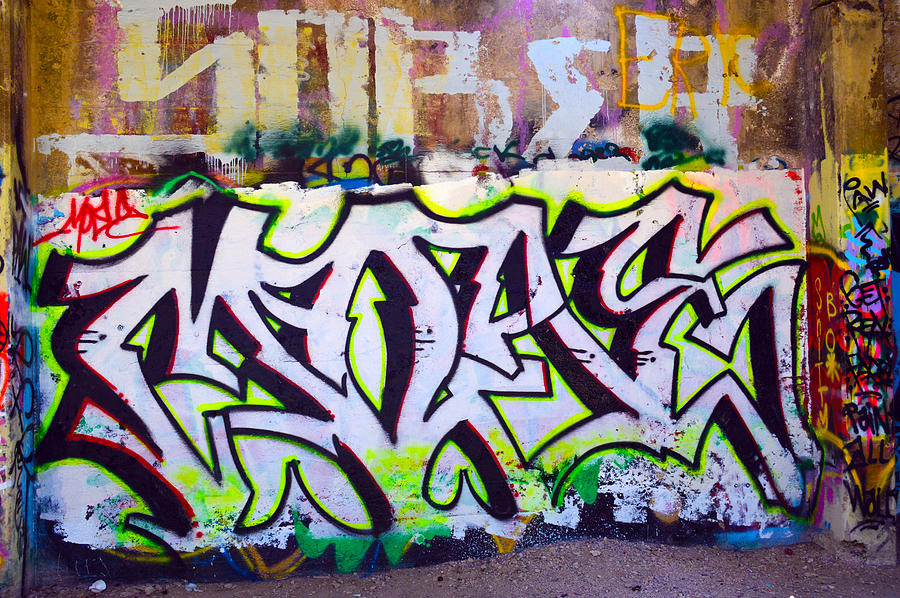
This screenshot has width=900, height=598. I want to click on white paint, so click(x=238, y=261).